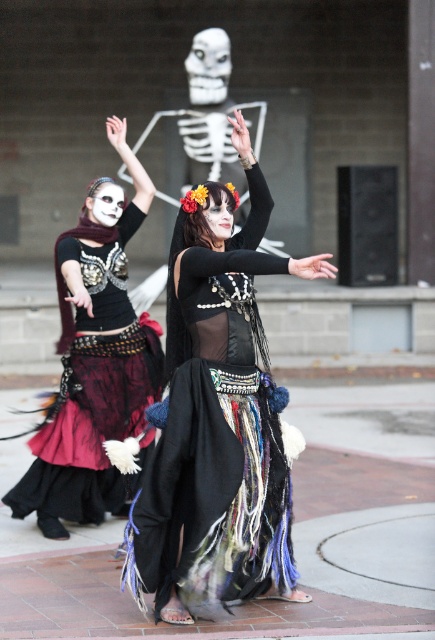
Does black lace skirt at center appear over matte black dress at center?

Incorrect, black lace skirt at center is not positioned above matte black dress at center.

This screenshot has width=435, height=640. What do you see at coordinates (218, 419) in the screenshot?
I see `black lace skirt at center` at bounding box center [218, 419].

Locate an element on the screen. The width and height of the screenshot is (435, 640). black lace skirt at center is located at coordinates (218, 419).

At what (x,y) coordinates should I click in order to perform the action: click on black lace skirt at center. Please return your answer as a coordinate pair (x, y). This screenshot has height=640, width=435. Looking at the image, I should click on [218, 419].